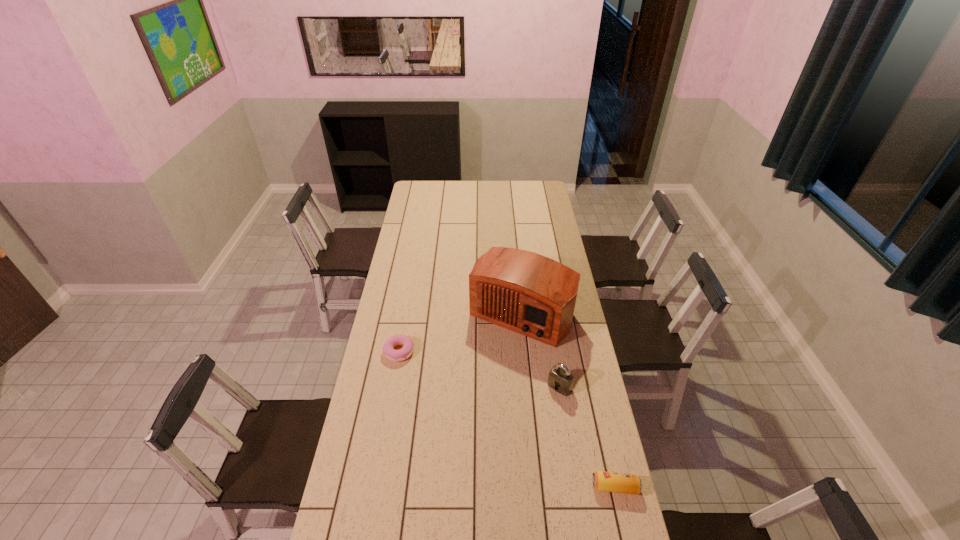
Where is `vacant position at the near edge of the desktop`? Image resolution: width=960 pixels, height=540 pixels. vacant position at the near edge of the desktop is located at coordinates (454, 519).

This screenshot has width=960, height=540. Find the location of `vacant area at the left edge of the desktop`. vacant area at the left edge of the desktop is located at coordinates (379, 451).

Find the location of `free space at the right edge of the desktop`. free space at the right edge of the desktop is located at coordinates (532, 231).

You are a GUI agent. You are given a task and a screenshot of the screen. Output one action in this format:
    pyautogui.click(x=<x>, y=<y>)
    Task: Click on the free spot between the radio receiver and the second shortest object
    The image size is (960, 540).
    Given the screenshot: What is the action you would take?
    [x=568, y=400]

You are a GUI agent. You are given a task and a screenshot of the screen. Output one action in this format:
    pyautogui.click(x=<x>, y=<y>)
    Task: Click on the vacant area that lies between the pastry and the second tallest object
    
    Given the screenshot: What is the action you would take?
    pyautogui.click(x=479, y=369)

Where is `vacant point located between the pastry and the tallest object`? vacant point located between the pastry and the tallest object is located at coordinates (460, 333).

At what (x,y) coordinates should I click in order to perform the action: click on free space between the radio receiver and the third farthest object. Please return your answer as a coordinate pair (x, y). The image size is (960, 540). Looking at the image, I should click on (540, 350).

Locate an element on the screen. free space between the pastry and the radio receiver is located at coordinates (460, 333).

What are the coordinates of `vacant space that's between the third shortest object and the tallest object` in the screenshot? It's located at (540, 350).

At what (x,y) coordinates should I click in order to perform the action: click on free space between the beer can and the third shortest object. Please return your answer as a coordinate pair (x, y). This screenshot has height=540, width=960. Looking at the image, I should click on (588, 437).